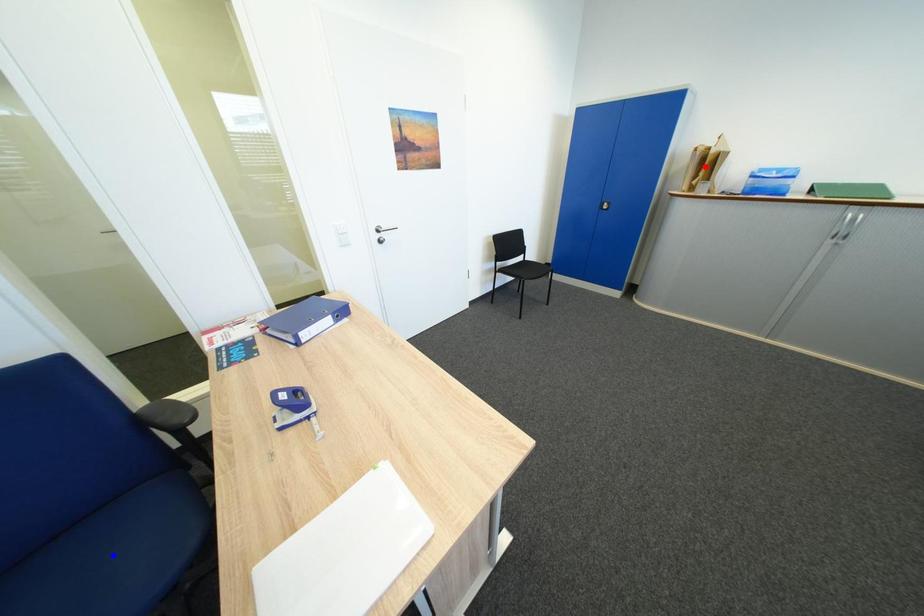
Question: In the image, two points are highlighted. Which point is nearer to the camera? Reply with the corresponding letter.

Choices:
 (A) blue point
 (B) red point

Answer: (A)